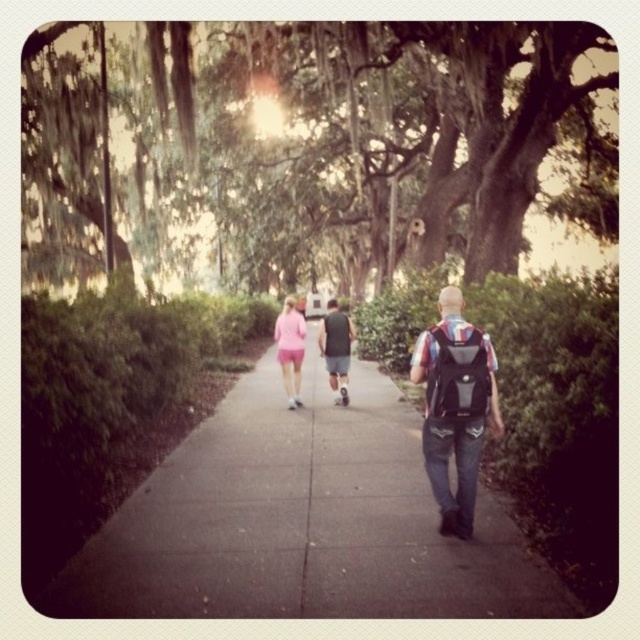
Question: In this image, where is concrete at center located relative to matte black backpack at center?

Choices:
 (A) below
 (B) above

Answer: (A)

Question: Can you confirm if black matte backpack at center is positioned above dark gray fabric shirt at center?

Choices:
 (A) yes
 (B) no

Answer: (B)

Question: Can you confirm if concrete at center is positioned below matte black backpack at center?

Choices:
 (A) no
 (B) yes

Answer: (B)

Question: Which object is farther from the camera taking this photo?

Choices:
 (A) concrete at center
 (B) dark gray fabric shirt at center
 (C) pink fabric shorts at center
 (D) black matte backpack at center

Answer: (B)

Question: Which is nearer to the green mossy tree at upper center?

Choices:
 (A) pink fabric shorts at center
 (B) dark gray fabric shirt at center
 (C) matte black backpack at center
 (D) concrete at center

Answer: (A)

Question: Which object is positioned closest to the green mossy tree at upper center?

Choices:
 (A) pink fabric shorts at center
 (B) matte black backpack at center
 (C) concrete at center

Answer: (A)